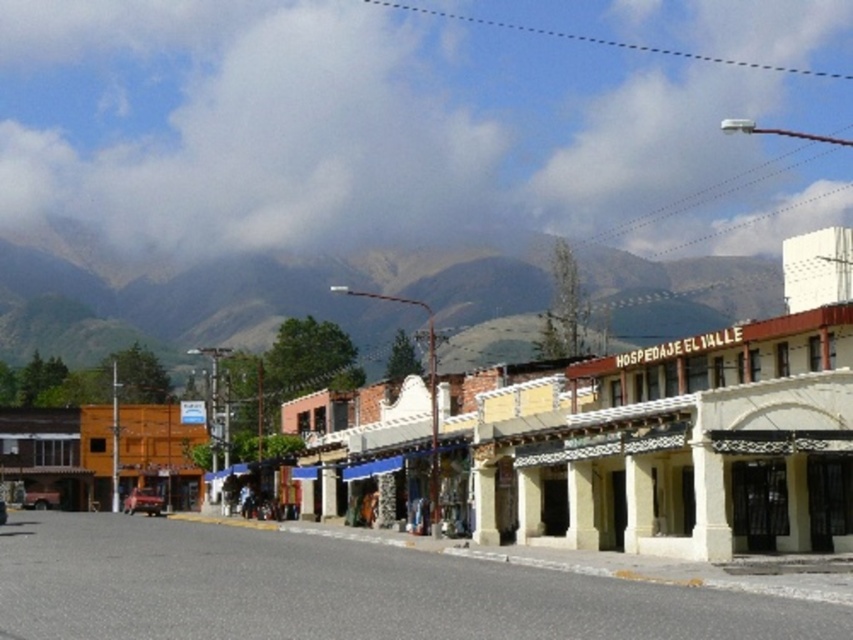
You are standing at the entrance of the yellow stucco building at center and want to take a photo of the green textured mountain at upper center. Which direction should you turn to face the mountain?

The green textured mountain at upper center is to the left of the yellow stucco building at center, so you should turn to your left to face the mountain.

You are a photographer planning to capture the entire scene in one shot. Given that the yellow stucco building at center and the green textured mountain at upper center are both in your viewfinder, which object will appear narrower in your photograph?

The yellow stucco building at center will appear narrower in the photograph because it is thinner than the green textured mountain at upper center according to the description.

You are standing at the camera position looking at the street scene. There are two points marked in the image, one at coordinates point (755, 493) and another at point (180, 324). Which point is nearer to you?

Point (755, 493) is closer to the camera than point (180, 324), so the point at coordinates point (755, 493) is nearer to you.